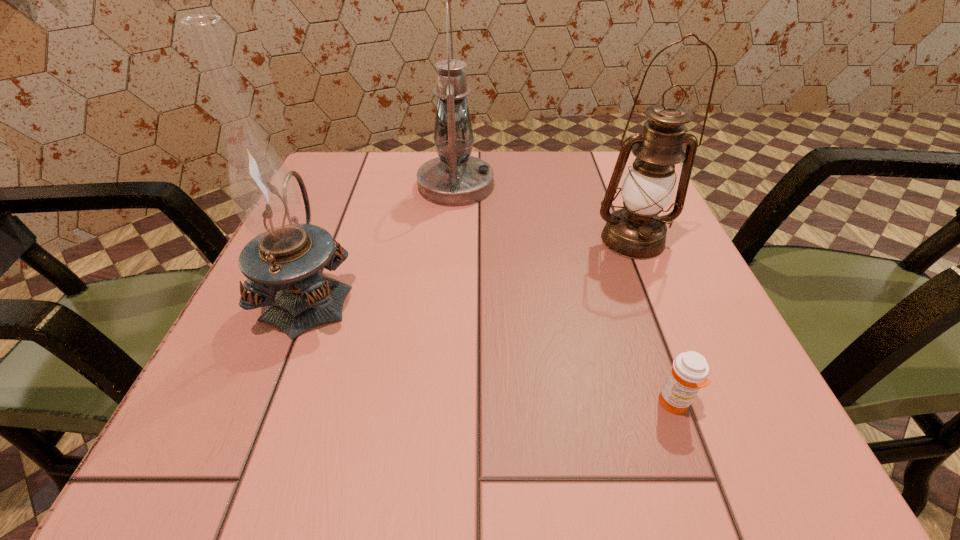
Where is `the leftmost object`? The height and width of the screenshot is (540, 960). the leftmost object is located at coordinates pos(282,262).

The image size is (960, 540). Identify the location of the farthest oil lamp. (454, 179).

Where is `the second object from left to right`? The width and height of the screenshot is (960, 540). the second object from left to right is located at coordinates (454, 179).

Where is `the rightmost oil lamp`? This screenshot has height=540, width=960. the rightmost oil lamp is located at coordinates (636, 231).

This screenshot has height=540, width=960. What are the coordinates of `the nearest object` in the screenshot? It's located at (689, 372).

The image size is (960, 540). In order to click on the shortest object in this screenshot , I will do `click(689, 372)`.

The height and width of the screenshot is (540, 960). In order to click on free space located on the front of the leftmost oil lamp in this screenshot , I will do `click(281, 369)`.

Image resolution: width=960 pixels, height=540 pixels. In order to click on vacant point located 0.360m on the front of the farthest object in this screenshot , I will do `click(444, 349)`.

You are a GUI agent. You are given a task and a screenshot of the screen. Output one action in this format:
    pyautogui.click(x=<x>, y=<y>)
    Task: Click on the vacant space located on the left of the rightmost oil lamp
    Image resolution: width=960 pixels, height=540 pixels.
    Given the screenshot: What is the action you would take?
    pyautogui.click(x=529, y=240)

The height and width of the screenshot is (540, 960). Identify the location of vacant space located on the right of the shortest object. (736, 403).